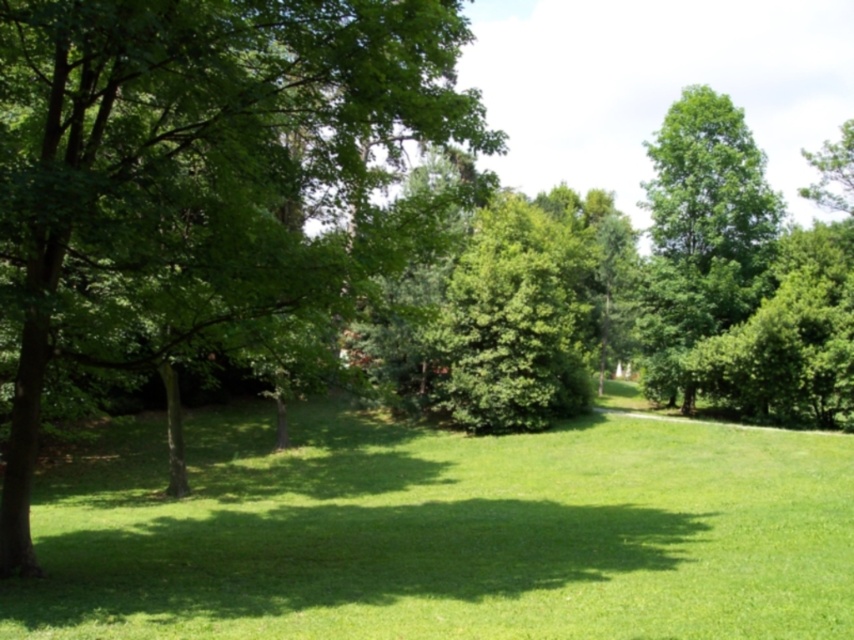
Is green leafy tree at left further to the viewer compared to green leafy tree at upper right?

That is False.

Who is more distant from viewer, (267, 182) or (645, 337)?

Point (645, 337)

Identify the location of green leafy tree at left. (192, 168).

Which of these two, green grass at center or green leafy tree at left, stands shorter?

Standing shorter between the two is green grass at center.

Is point (389, 572) farther from camera compared to point (145, 35)?

Yes, it is behind point (145, 35).

Where is `green grass at center`? This screenshot has height=640, width=854. green grass at center is located at coordinates (443, 532).

Where is `green grass at center`? The height and width of the screenshot is (640, 854). green grass at center is located at coordinates click(x=443, y=532).

Which is more to the left, green grass at center or green leafy tree at upper right?

green grass at center is more to the left.

Does point (390, 428) lie in front of point (711, 93)?

That is True.

Between point (120, 442) and point (728, 275), which one is positioned in front?

Positioned in front is point (120, 442).

The height and width of the screenshot is (640, 854). In order to click on green grass at center in this screenshot , I will do `click(443, 532)`.